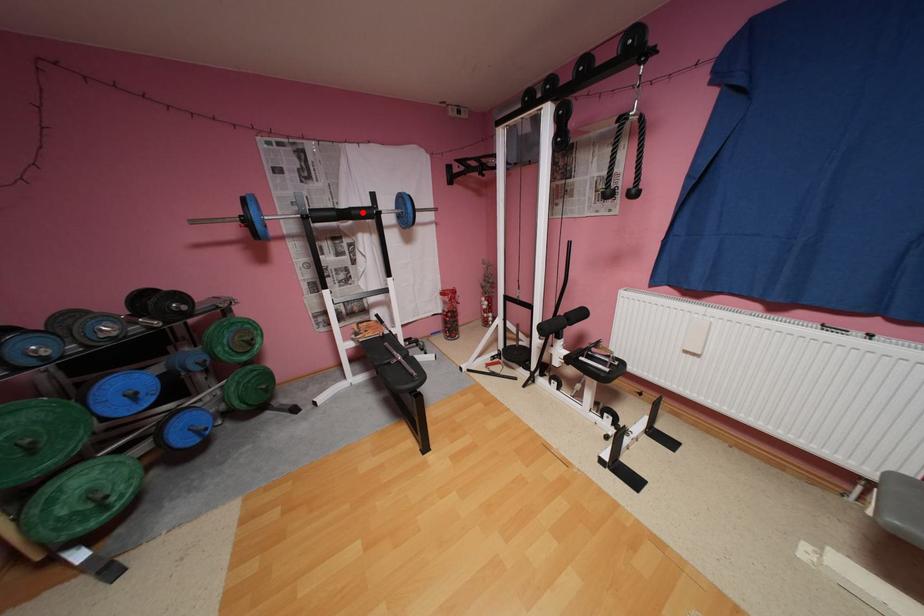
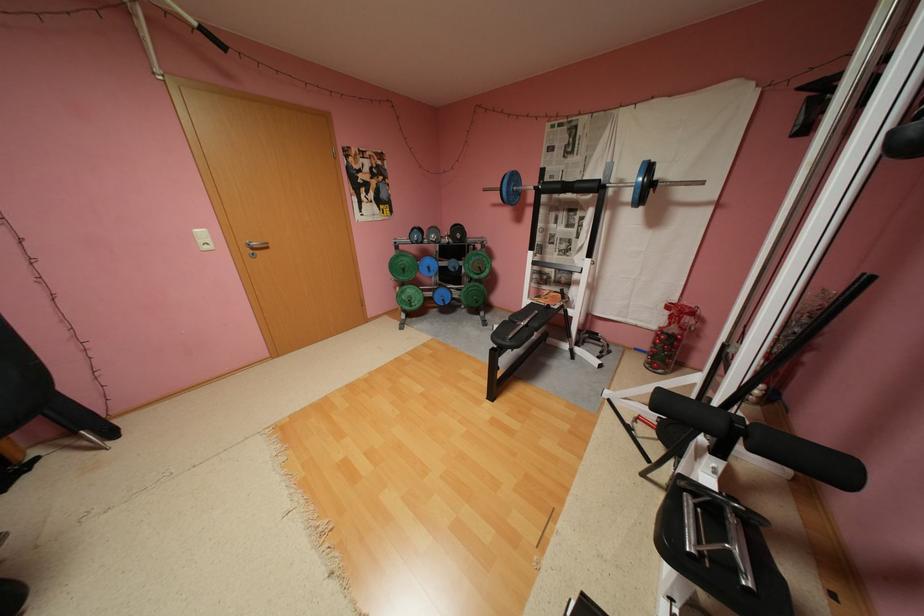
In the second image, find the point that corresponds to the highlighted location in the first image.

(586, 185)